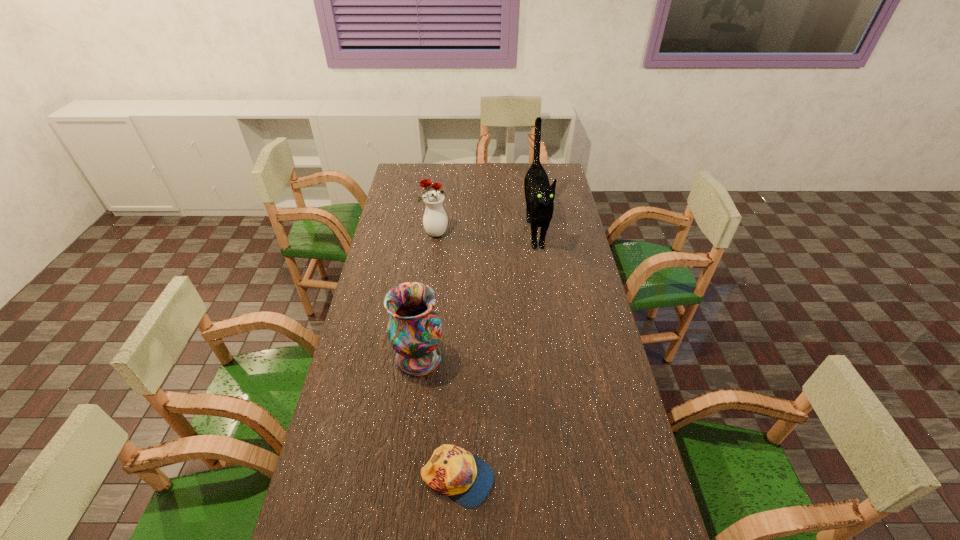
You are a GUI agent. You are given a task and a screenshot of the screen. Output one action in this format:
    pyautogui.click(x=<x>, y=<y>)
    Task: Click on the object present at the left edge
    
    Given the screenshot: What is the action you would take?
    pyautogui.click(x=414, y=330)

The height and width of the screenshot is (540, 960). In order to click on object present at the right edge in this screenshot , I will do `click(539, 194)`.

This screenshot has height=540, width=960. In order to click on vacant space at the far edge of the desktop in this screenshot , I will do `click(502, 167)`.

At what (x,y) coordinates should I click in order to perform the action: click on free spot at the left edge of the desktop. Please return your answer as a coordinate pair (x, y). This screenshot has width=960, height=540. Looking at the image, I should click on (328, 469).

Where is `vacant position at the right edge of the desktop`? The image size is (960, 540). vacant position at the right edge of the desktop is located at coordinates (603, 440).

Find the location of `blank space at the far left corner`. blank space at the far left corner is located at coordinates (420, 171).

Identify the location of free spot between the shortest object and the nearer vase. (438, 418).

Where is `free space between the second nearest object and the cat`? The image size is (960, 540). free space between the second nearest object and the cat is located at coordinates (477, 293).

Where is `free space that is in between the nearer vase and the cat`? Image resolution: width=960 pixels, height=540 pixels. free space that is in between the nearer vase and the cat is located at coordinates (477, 293).

Identify the location of free space between the nearest object and the farther vase. This screenshot has width=960, height=540. (446, 356).